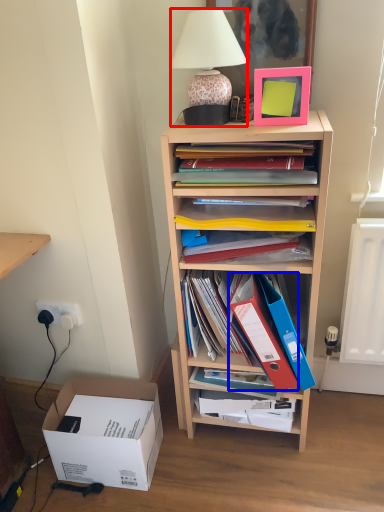
Question: Which point is closer to the camera, lamp (highlighted by a red box) or paperback book (highlighted by a blue box)?

Choices:
 (A) lamp
 (B) paperback book

Answer: (A)